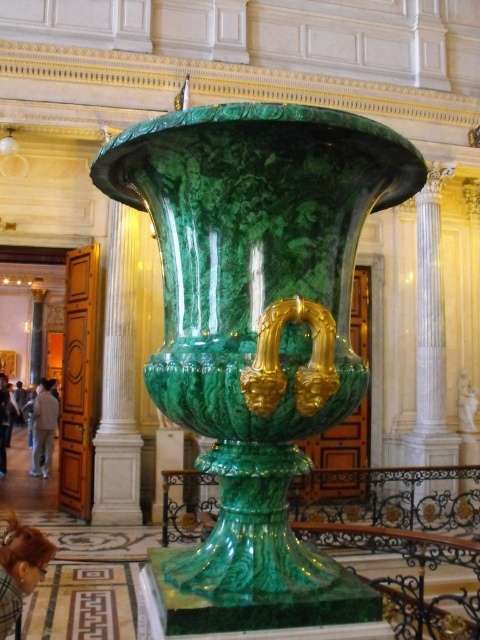
Does brown hair at lower left appear over light brown leather jacket at lower left?

Yes, brown hair at lower left is above light brown leather jacket at lower left.

Which is behind, point (17, 563) or point (51, 426)?

The point (51, 426) is behind.

Is point (6, 525) positioned in front of point (35, 422)?

Yes, it is.

Where is `brown hair at lower left`? brown hair at lower left is located at coordinates (20, 566).

Does green marble vase at center have a lesser height compared to light brown leather jacket at lower left?

Correct, green marble vase at center is not as tall as light brown leather jacket at lower left.

Is green marble vase at center to the right of light brown leather jacket at lower left from the viewer's perspective?

Yes, green marble vase at center is to the right of light brown leather jacket at lower left.

Is point (229, 266) closer to camera compared to point (47, 449)?

Yes.

Where is `green marble vase at center`? green marble vase at center is located at coordinates (256, 308).

Which is more to the left, green marble vase at center or brown hair at lower left?

Positioned to the left is brown hair at lower left.

Find the location of a particular element. The image size is (480, 640). green marble vase at center is located at coordinates (256, 308).

The width and height of the screenshot is (480, 640). I want to click on green marble vase at center, so click(256, 308).